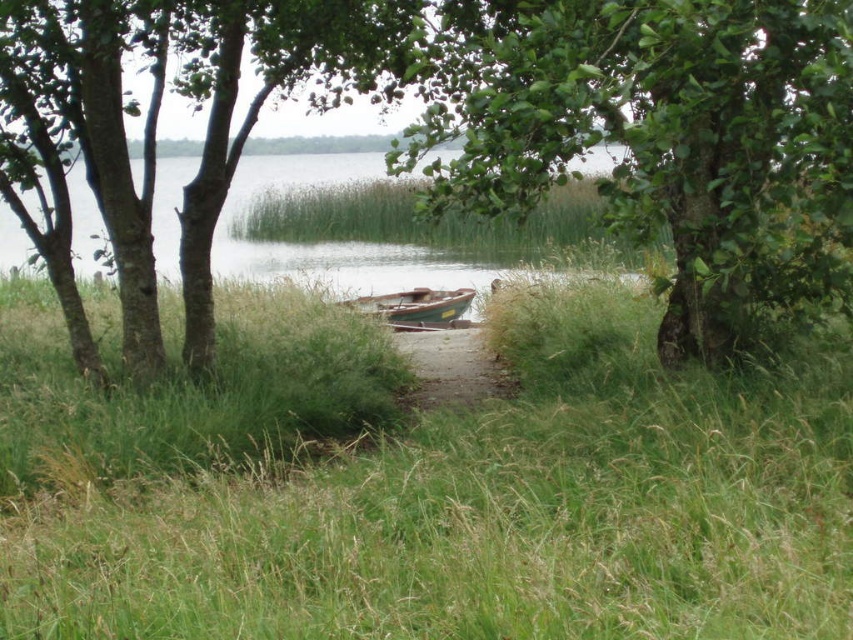
Can you confirm if rough bark tree at center is positioned below brown dirt path at center?

No.

What do you see at coordinates (194, 99) in the screenshot? The width and height of the screenshot is (853, 640). I see `rough bark tree at center` at bounding box center [194, 99].

Find the location of a particular element. This screenshot has height=640, width=853. rough bark tree at center is located at coordinates (194, 99).

Is green grassy at center above brown dirt path at center?

No, green grassy at center is not above brown dirt path at center.

This screenshot has height=640, width=853. What do you see at coordinates (424, 484) in the screenshot?
I see `green grassy at center` at bounding box center [424, 484].

The image size is (853, 640). Identify the location of green grassy at center. (424, 484).

Can you confirm if green leafy tree at center is positioned to the right of wooden boat at center?

Indeed, green leafy tree at center is positioned on the right side of wooden boat at center.

Can you confirm if green leafy tree at center is wider than wooden boat at center?

Incorrect, green leafy tree at center's width does not surpass wooden boat at center's.

Is point (418, 51) closer to viewer compared to point (454, 292)?

Yes, point (418, 51) is closer to viewer.

The height and width of the screenshot is (640, 853). Identify the location of green leafy tree at center. (660, 138).